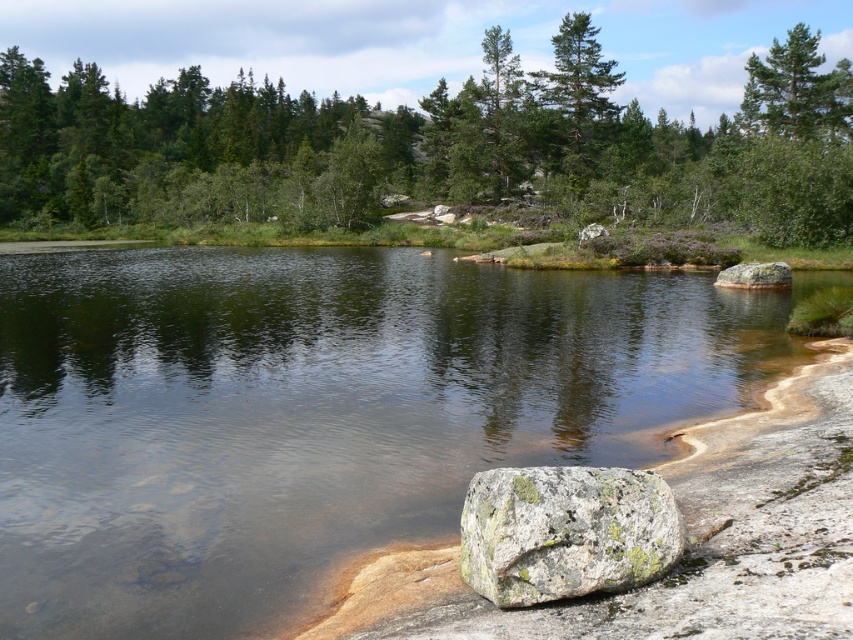
Can you confirm if green leafy trees at upper center is positioned to the left of gray rough rock at right?

Indeed, green leafy trees at upper center is positioned on the left side of gray rough rock at right.

Between green leafy trees at upper center and gray rough rock at right, which one has less height?

gray rough rock at right is shorter.

This screenshot has width=853, height=640. Describe the element at coordinates (433, 147) in the screenshot. I see `green leafy trees at upper center` at that location.

The height and width of the screenshot is (640, 853). In order to click on green leafy trees at upper center in this screenshot , I will do `click(433, 147)`.

Is green textured pine tree at upper right above gray rough rock at right?

Correct, green textured pine tree at upper right is located above gray rough rock at right.

Which is in front, point (759, 124) or point (727, 275)?

Point (727, 275) is in front.

Identify the location of green textured pine tree at upper right. The height and width of the screenshot is (640, 853). (796, 90).

Which is more to the right, clear water at center or gray rough rock at right?

Positioned to the right is gray rough rock at right.

In the scene shown: Between clear water at center and gray rough rock at right, which one has more height?

clear water at center

Is point (312, 369) positioned before point (776, 280)?

Yes, point (312, 369) is closer to viewer.

Identify the location of clear water at center. (317, 412).